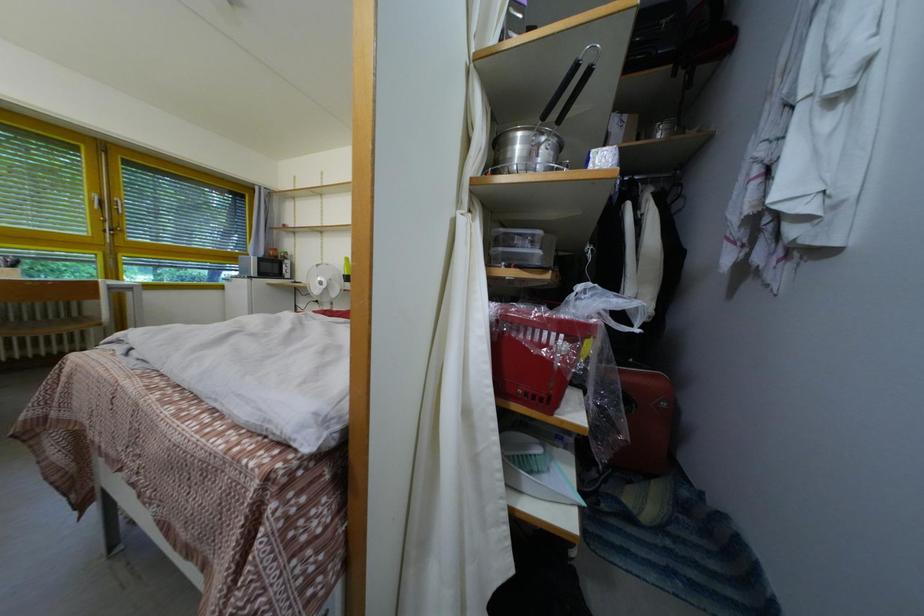
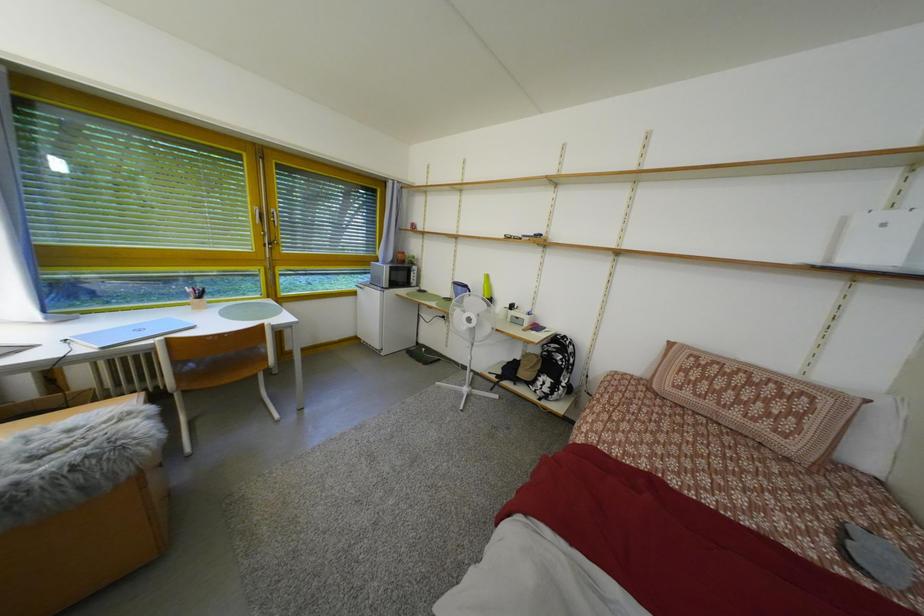
In a continuous first-person perspective shot, in which direction is the camera moving?

The cameraman walked toward left, forward.